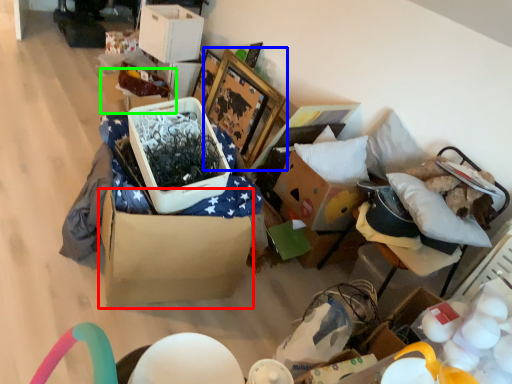
Question: Which object is positioned farthest from cardboard box (highlighted by a red box)? Select from picture frame (highlighted by a blue box) and storage box (highlighted by a green box).

Choices:
 (A) picture frame
 (B) storage box

Answer: (B)